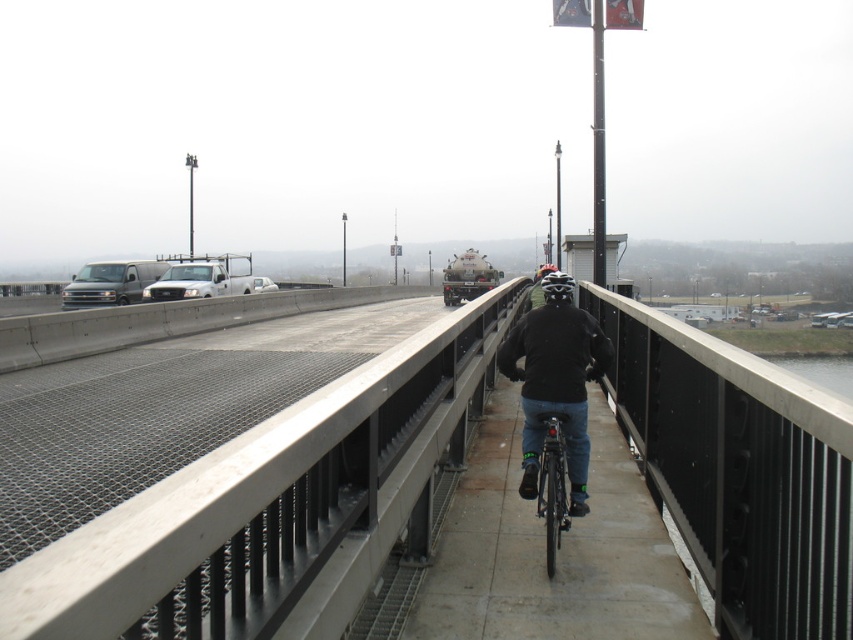
Question: Does smooth concrete bridge at center have a lesser width compared to shiny metallic bicycle at center?

Choices:
 (A) yes
 (B) no

Answer: (A)

Question: Is smooth concrete bridge at center closer to camera compared to shiny metallic bicycle at center?

Choices:
 (A) no
 (B) yes

Answer: (B)

Question: Does smooth concrete bridge at center have a smaller size compared to dark blue jeans at center?

Choices:
 (A) no
 (B) yes

Answer: (B)

Question: Which point appears closest to the camera in this image?

Choices:
 (A) (558, 330)
 (B) (107, 582)

Answer: (B)

Question: Estimate the real-world distances between objects in this image. Which object is closer to the shiny metallic bicycle at center?

Choices:
 (A) dark blue jeans at center
 (B) smooth concrete bridge at center

Answer: (A)

Question: Among these points, which one is nearest to the camera?

Choices:
 (A) (538, 506)
 (B) (451, 433)

Answer: (A)